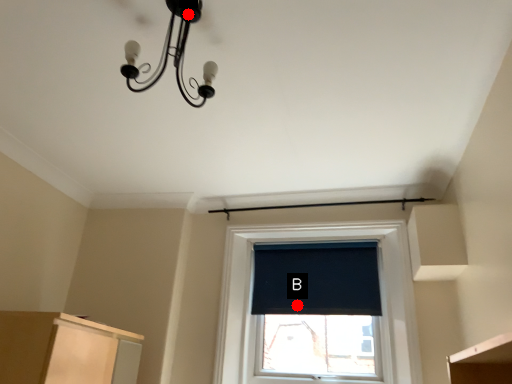
Question: Two points are circled on the image, labeled by A and B beside each circle. Which point appears closest to the camera in this image?

Choices:
 (A) A is closer
 (B) B is closer

Answer: (A)